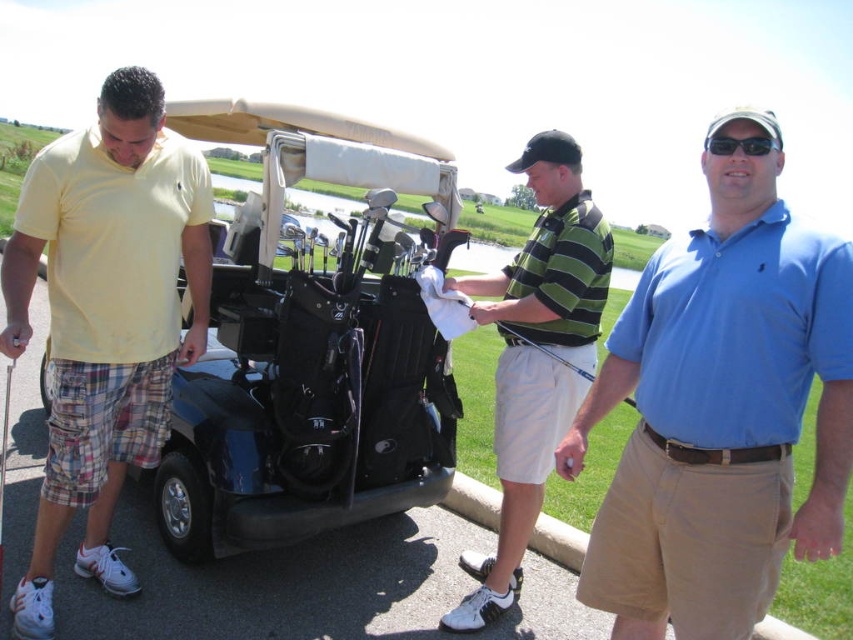
Question: Is blue cotton polo shirt at center to the left of striped polo shirt at center from the viewer's perspective?

Choices:
 (A) yes
 (B) no

Answer: (B)

Question: Which of these objects is positioned closest to the blue cotton polo shirt at right?

Choices:
 (A) black matte golf cart at left
 (B) blue cotton polo shirt at center

Answer: (B)

Question: Is yellow matte polo shirt at left smaller than black plastic sunglasses at upper center?

Choices:
 (A) yes
 (B) no

Answer: (B)

Question: Which point is farther from the camera taking this photo?

Choices:
 (A) (634, 289)
 (B) (791, 218)

Answer: (A)

Question: Does black matte golf cart at left appear over blue cotton polo shirt at right?

Choices:
 (A) no
 (B) yes

Answer: (B)

Question: Which object is the farthest from the yellow cotton polo shirt at left?

Choices:
 (A) blue cotton polo shirt at center
 (B) striped polo shirt at center
 (C) black matte golf cart at left
 (D) blue cotton polo shirt at right

Answer: (D)